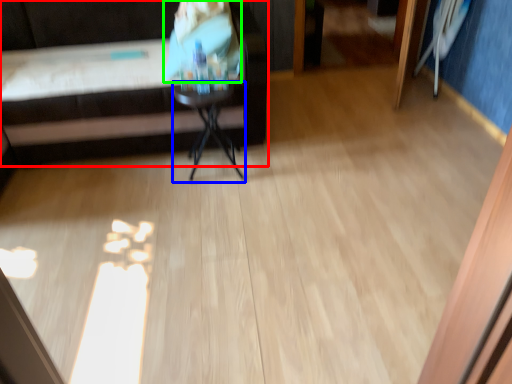
Question: Which object is positioned farthest from furniture (highlighted by a red box)? Select from side table (highlighted by a blue box) and person (highlighted by a green box).

Choices:
 (A) side table
 (B) person

Answer: (B)